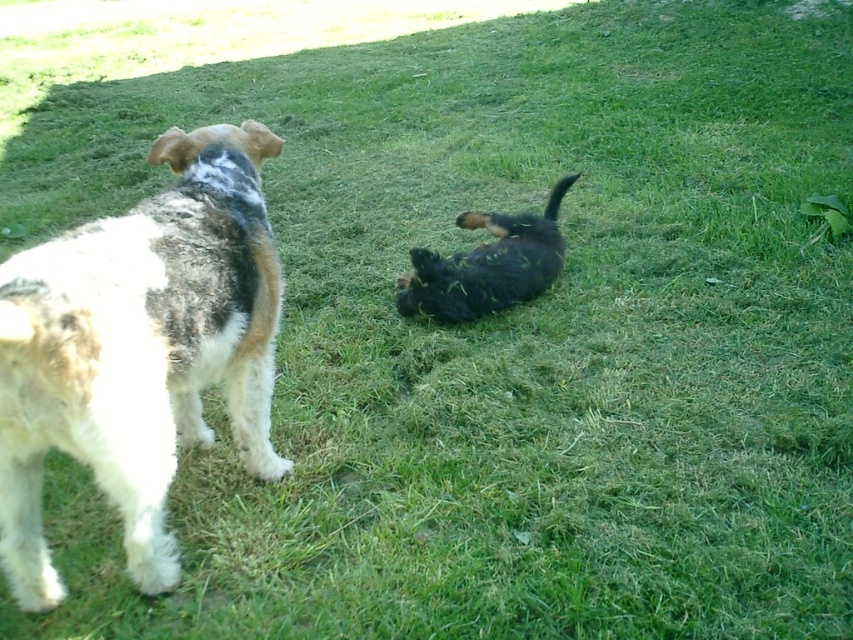
Does point (242, 332) come farther from viewer compared to point (454, 301)?

No, (242, 332) is in front of (454, 301).

Who is shorter, white fur dog at left or black fuzzy dog at center?

black fuzzy dog at center is shorter.

Who is more forward, (254, 209) or (496, 268)?

Point (254, 209) is in front.

Find the location of a particular element. white fur dog at left is located at coordinates (138, 349).